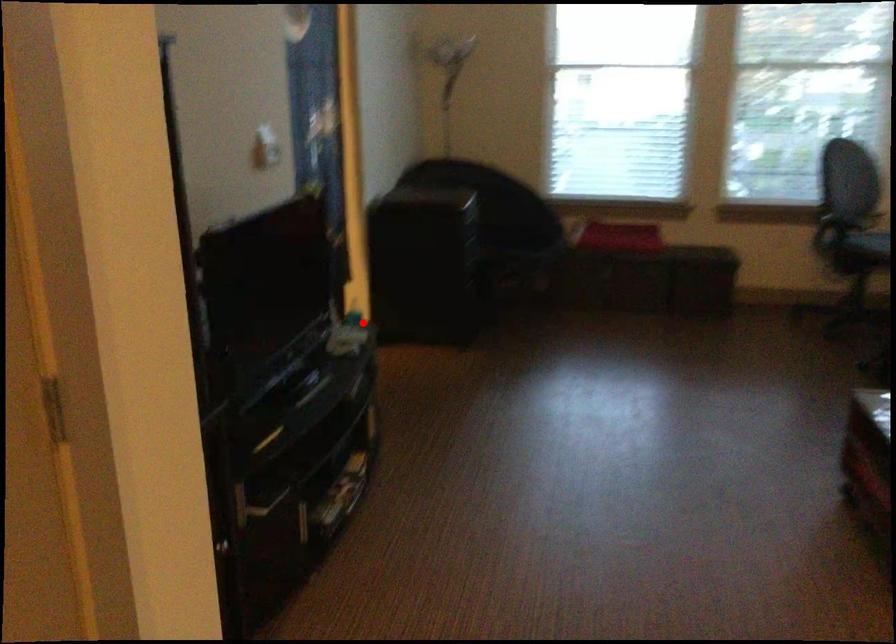
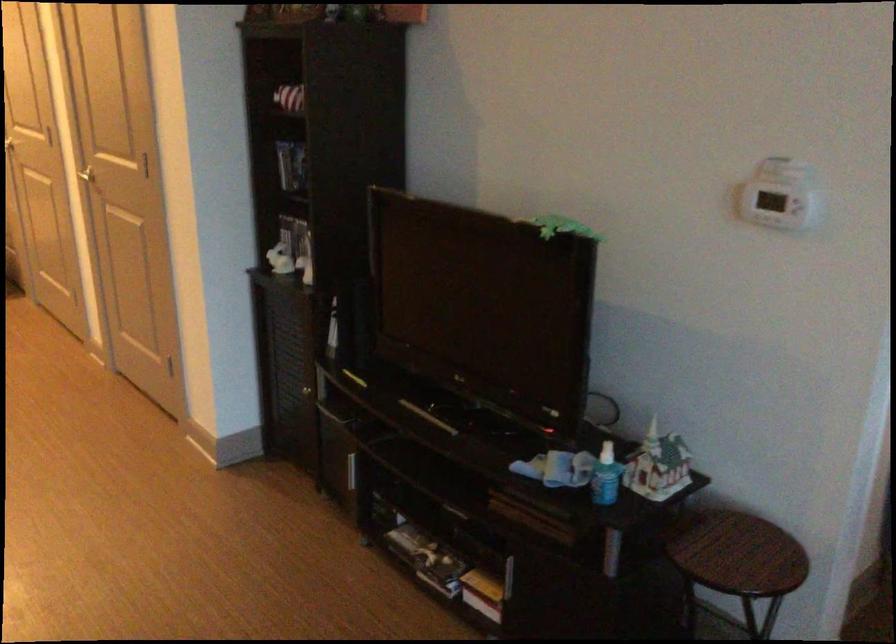
Where in the second image is the point corresponding to the highlighted location from the first image?

(606, 476)